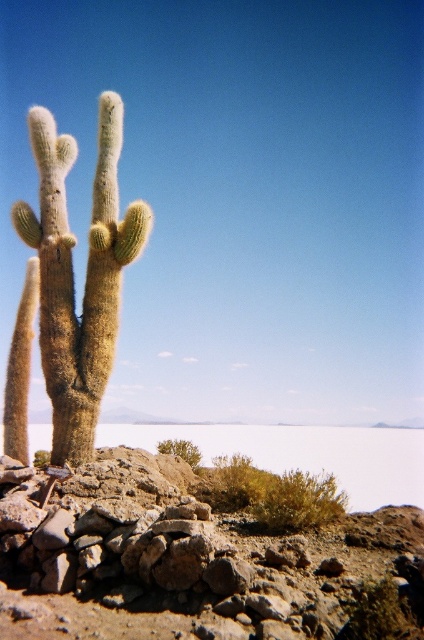
You are a desert explorer who needs to cross the brown rocky plain at lower center. There is a green fuzzy cactus at left blocking your path. Can you walk around it to reach the plain?

The green fuzzy cactus at left is positioned on the left side of the brown rocky plain at lower center, so you can walk around it to the right side to reach the plain.

You are a hiker trying to navigate through the desert. You see the rusty stone boulder at center and the brown rocky plain at lower center. Which one is shorter in height?

The rusty stone boulder at center is not as tall as the brown rocky plain at lower center, so the rusty stone boulder at center is shorter in height.